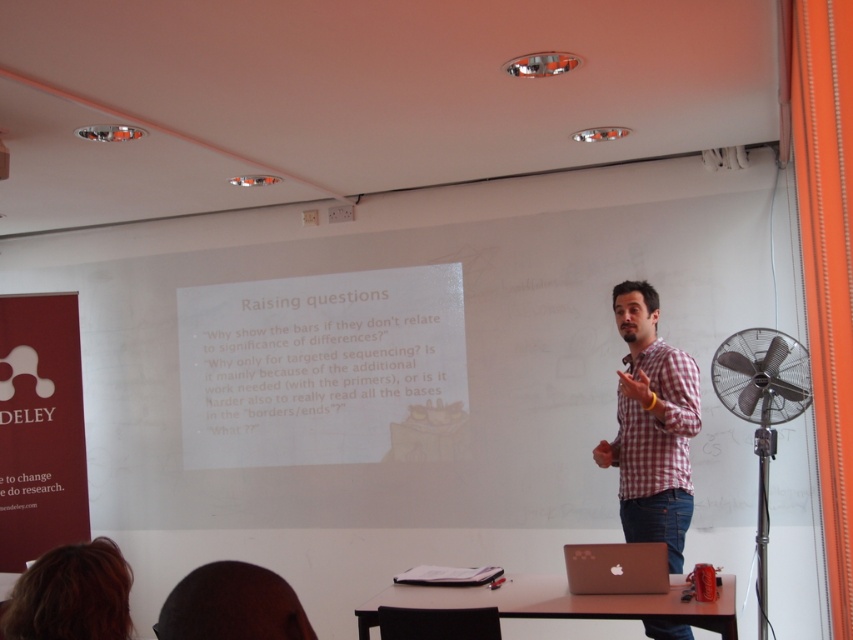
You are a student sitting in the classroom and need to check the laptop of the presenter. Which object is wider, the brown hair at lower left or the satin gold laptop at center?

The satin gold laptop at center is wider than the brown hair at lower left.

You are sitting at the back of the classroom and want to ask a question. You need to decide whether to use the black matte microphone at center or the satin gold laptop at center to speak. Which device is closer to you?

The satin gold laptop at center is in front of the black matte microphone at center, so the black matte microphone at center is closer to you since it is behind the laptop.

You are an attendee at the presentation and want to ask a question. The presenter is wearing a checkered fabric shirt at center and holding a black matte microphone at center. Where should you look to see the presenter first?

The checkered fabric shirt at center is below the black matte microphone at center, so you should look at the black matte microphone at center first as it is higher up.